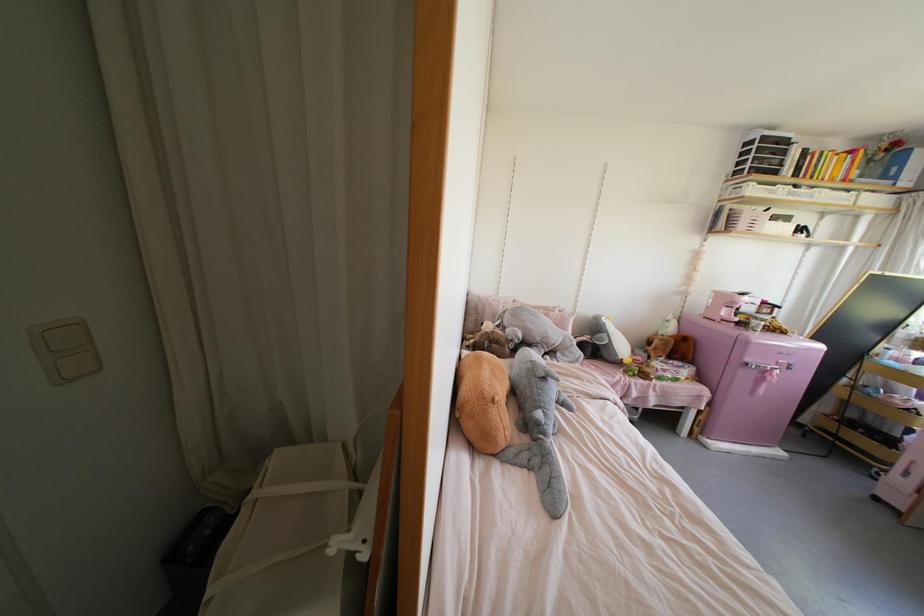
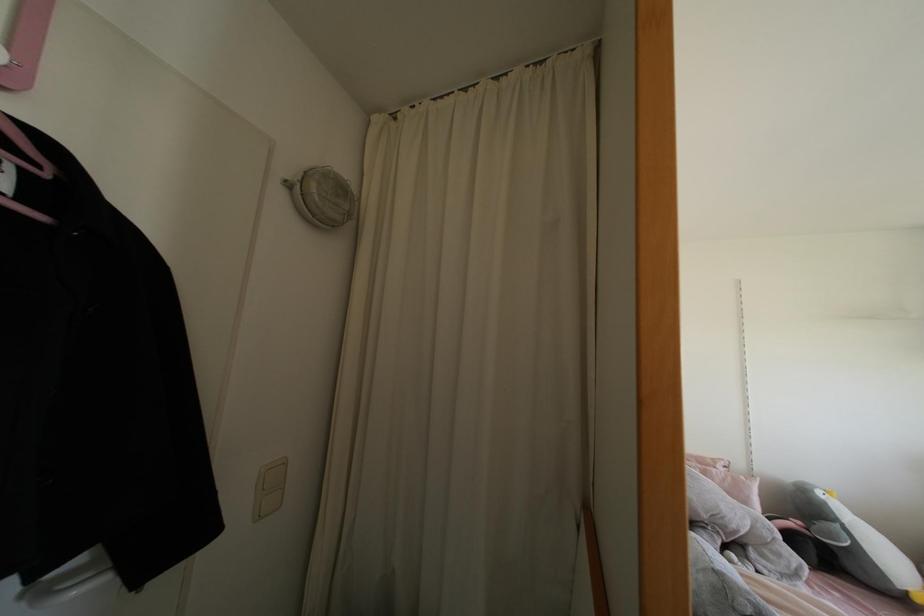
Locate, in the second image, the point that corresponds to point 602,318 in the first image.

(819, 493)